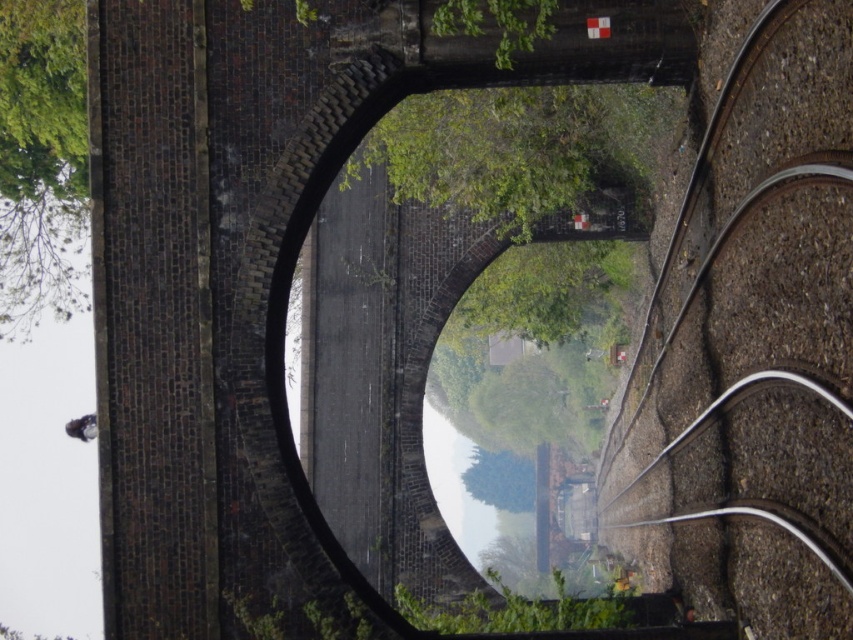
Who is more distant from viewer, (677, 116) or (61, 113)?

The point (61, 113) is more distant.

Which is in front, point (496, 125) or point (13, 19)?

Point (13, 19) is in front.

Image resolution: width=853 pixels, height=640 pixels. I want to click on green leafy tree at center, so click(x=519, y=148).

Where is `green leafy tree at center`? green leafy tree at center is located at coordinates (519, 148).

Is brick at center wider than brown gravel train track at right?

Indeed, brick at center has a greater width compared to brown gravel train track at right.

Can you confirm if brick at center is taller than brown gravel train track at right?

No, brick at center is not taller than brown gravel train track at right.

Is point (248, 330) less distant than point (764, 468)?

No, it is behind (764, 468).

At what (x,y) coordinates should I click in order to perform the action: click on brick at center. Please return your answer as a coordinate pair (x, y). The width and height of the screenshot is (853, 640). Looking at the image, I should click on (253, 272).

What do you see at coordinates (253, 272) in the screenshot?
I see `brick at center` at bounding box center [253, 272].

Based on the photo, is brick at center to the right of green leafy tree at center from the viewer's perspective?

Incorrect, brick at center is not on the right side of green leafy tree at center.

Which is behind, point (430, 509) or point (428, 100)?

The point (430, 509) is behind.

This screenshot has width=853, height=640. What are the coordinates of `brick at center` in the screenshot? It's located at (253, 272).